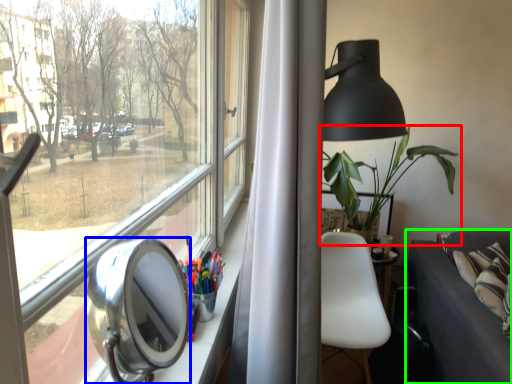
Question: Based on their relative distances, which object is nearer to houseplant (highlighted by a red box)? Choose from view mirror (highlighted by a blue box) and studio couch (highlighted by a green box).

Choices:
 (A) view mirror
 (B) studio couch

Answer: (B)